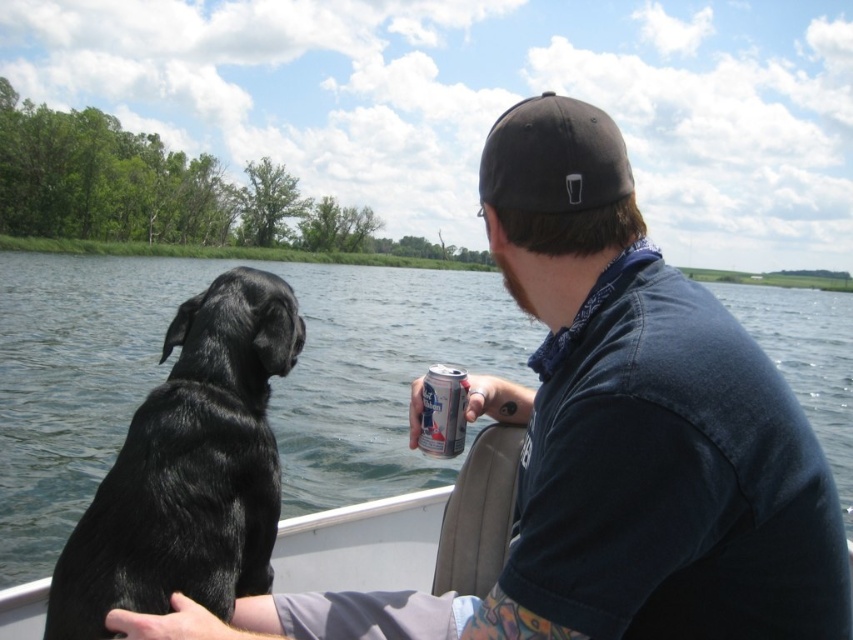
Question: Among these points, which one is farthest from the camera?

Choices:
 (A) (190, 316)
 (B) (566, 100)
 (C) (448, 412)

Answer: (A)

Question: Does black fabric baseball cap at upper center come behind silver metallic can at center?

Choices:
 (A) yes
 (B) no

Answer: (B)

Question: Based on their relative distances, which object is nearer to the black fabric baseball cap at upper center?

Choices:
 (A) black shiny fur dog at left
 (B) silver metallic can at center

Answer: (A)

Question: Is black fabric baseball cap at upper center bigger than silver metallic can at center?

Choices:
 (A) yes
 (B) no

Answer: (A)

Question: Among these points, which one is nearest to the camera?

Choices:
 (A) (567, 192)
 (B) (131, 502)

Answer: (A)

Question: Does black shiny fur dog at left have a smaller size compared to silver metallic can at center?

Choices:
 (A) yes
 (B) no

Answer: (B)